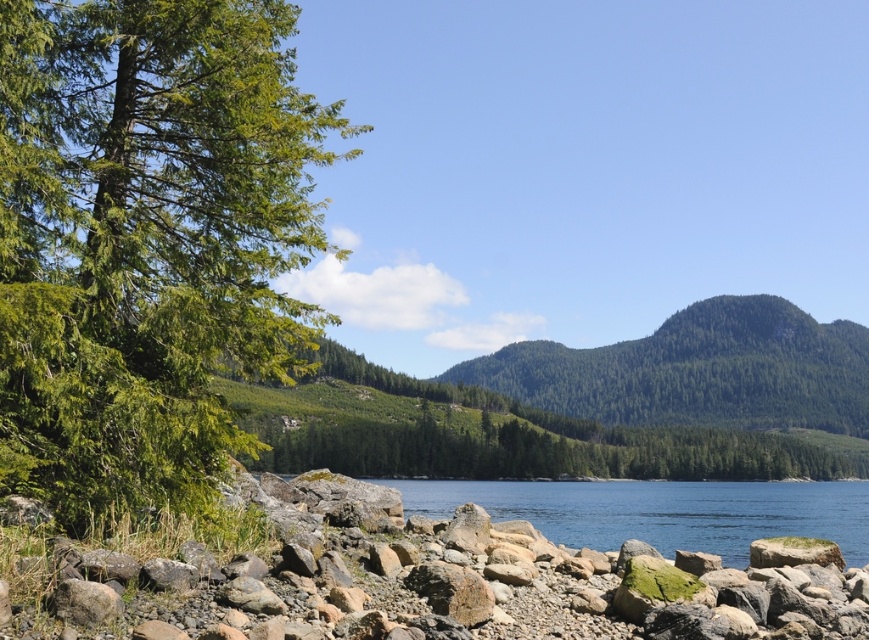
Does green textured tree at left have a smaller size compared to green forested mountain at center?

Yes, green textured tree at left is smaller than green forested mountain at center.

Between point (164, 28) and point (819, 410), which one is positioned in front?

Point (164, 28) is more forward.

Who is more distant from viewer, (104,147) or (726,353)?

Point (726,353)

Locate an element on the screen. The height and width of the screenshot is (640, 869). green textured tree at left is located at coordinates (146, 237).

Is green forested mountain at center bigger than clear water at center?

Indeed, green forested mountain at center has a larger size compared to clear water at center.

Who is more distant from viewer, (645, 419) or (670, 516)?

Positioned behind is point (645, 419).

In order to click on green forested mountain at center in this screenshot , I will do `click(697, 371)`.

Does rusty stone boulder at lower left appear over clear water at center?

Indeed, rusty stone boulder at lower left is positioned over clear water at center.

Locate an element on the screen. rusty stone boulder at lower left is located at coordinates point(442,582).